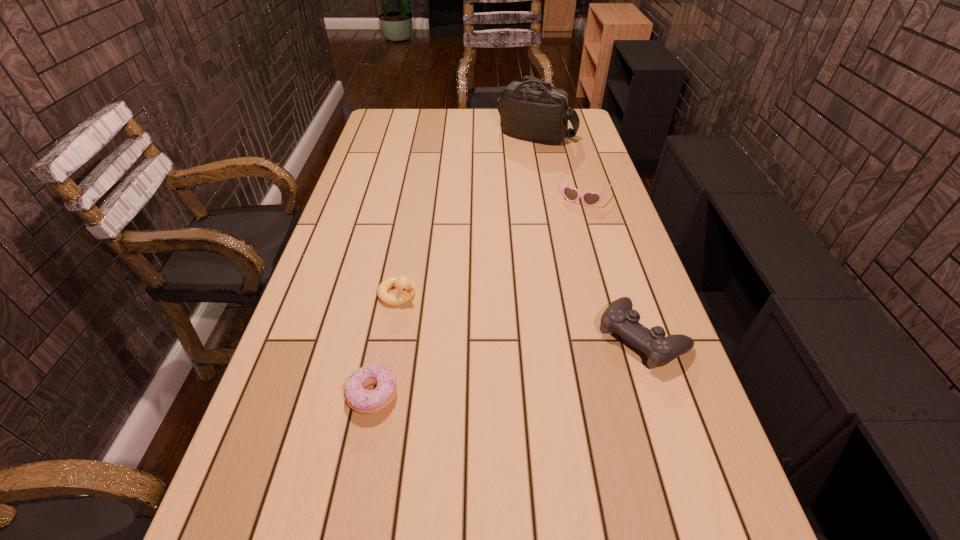
I want to click on blank space that satisfies the following two spatial constraints: 1. on the front side of the control; 2. on the right side of the farthest object, so click(576, 336).